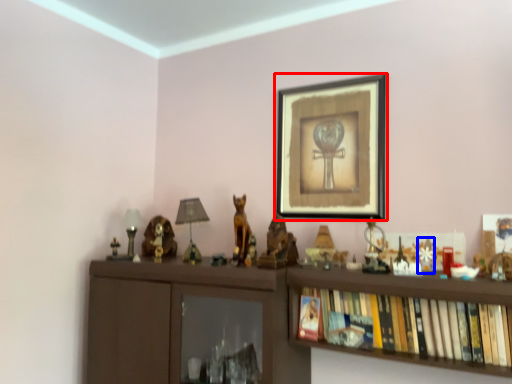
Question: Which of the following is the closest to the observer, picture frame (highlighted by a red box) or toy (highlighted by a blue box)?

Choices:
 (A) picture frame
 (B) toy

Answer: (B)